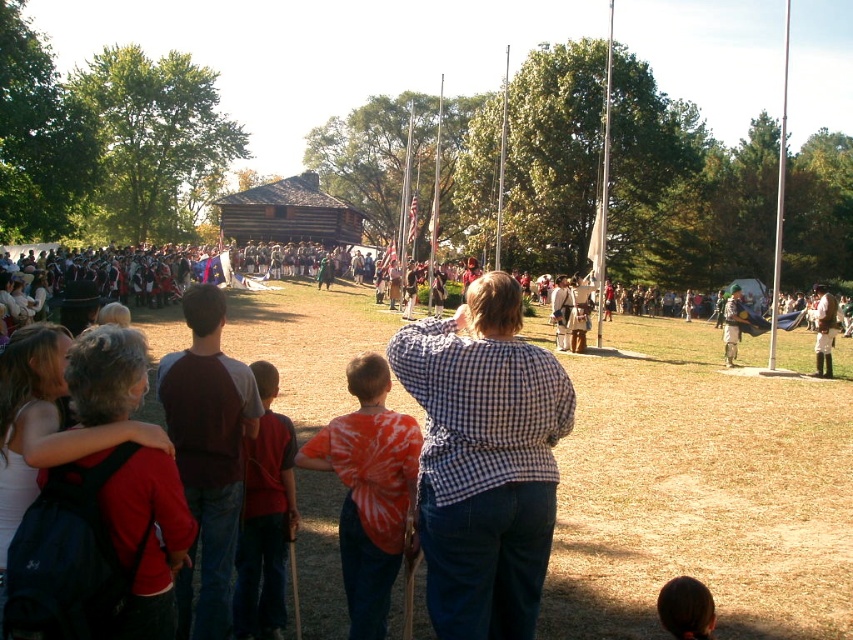
Is point (218, 496) less distant than point (354, 556)?

Yes.

Does brown cotton shirt at center appear over tie-dye shirt at center?

Indeed, brown cotton shirt at center is positioned over tie-dye shirt at center.

Is point (213, 502) positioned after point (357, 442)?

No, (213, 502) is closer to viewer.

The image size is (853, 640). In order to click on brown cotton shirt at center in this screenshot , I will do tap(207, 454).

Can you confirm if brown dry grass at center is positioned above metallic pole at right?

Incorrect, brown dry grass at center is not positioned above metallic pole at right.

Is point (751, 460) more distant than point (770, 349)?

No, (751, 460) is in front of (770, 349).

Where is `brown dry grass at center`? The width and height of the screenshot is (853, 640). brown dry grass at center is located at coordinates (700, 490).

Between tie-dye shirt at center and smooth silver pole at center, which one has more height?

With more height is smooth silver pole at center.

Does point (396, 557) come in front of point (498, 227)?

Yes, point (396, 557) is closer to viewer.

Does point (350, 605) come behind point (498, 220)?

No, (350, 605) is in front of (498, 220).

I want to click on tie-dye shirt at center, so click(x=369, y=490).